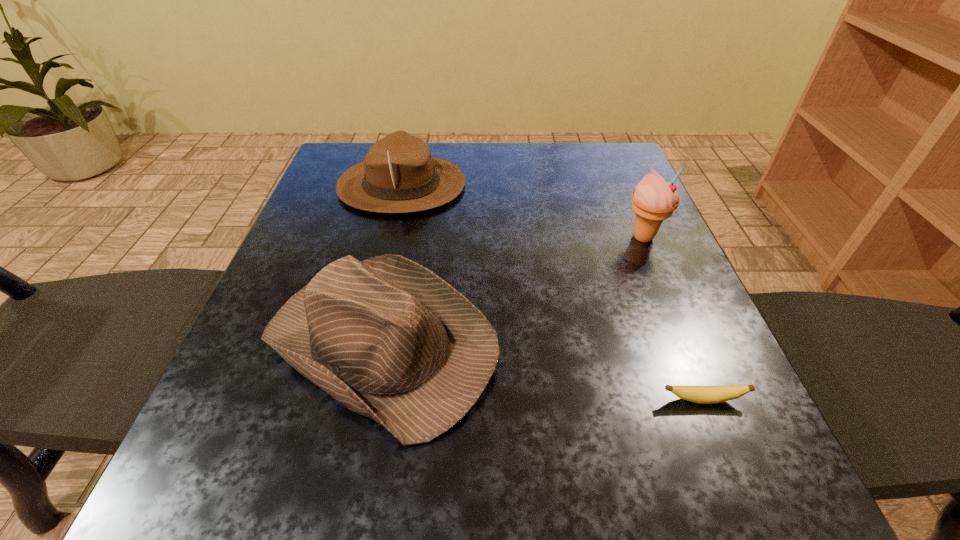
Locate an element on the screen. Image resolution: width=960 pixels, height=540 pixels. icecream situated at the right edge is located at coordinates (654, 200).

Image resolution: width=960 pixels, height=540 pixels. Find the location of `banana that is at the right edge`. banana that is at the right edge is located at coordinates (698, 394).

Image resolution: width=960 pixels, height=540 pixels. Find the location of `object at the far left corner`. object at the far left corner is located at coordinates (399, 175).

This screenshot has height=540, width=960. I want to click on object that is positioned at the near left corner, so click(389, 339).

You are a GUI agent. You are given a task and a screenshot of the screen. Output one action in this format:
    pyautogui.click(x=<x>, y=<y>)
    Task: Click on the free space at the near edge of the desktop
    
    Given the screenshot: What is the action you would take?
    pyautogui.click(x=530, y=478)

The height and width of the screenshot is (540, 960). In the image, there is a desktop. Find the location of `vacant space at the left edge`. vacant space at the left edge is located at coordinates (302, 267).

In the image, there is a desktop. At what (x,y) coordinates should I click in order to perform the action: click on free space at the right edge. Please return your answer as a coordinate pair (x, y). The width and height of the screenshot is (960, 540). Looking at the image, I should click on (683, 314).

Locate an element on the screen. free space at the near left corner is located at coordinates (260, 458).

This screenshot has height=540, width=960. What are the coordinates of `blank space at the near right corner of the desktop` in the screenshot? It's located at (803, 519).

I want to click on vacant space that is in between the third nearest object and the nearer fedora, so click(x=513, y=290).